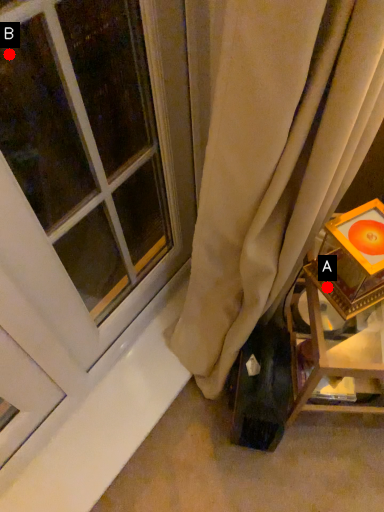
Question: Two points are circled on the image, labeled by A and B beside each circle. Which point is closer to the camera?

Choices:
 (A) A is closer
 (B) B is closer

Answer: (A)